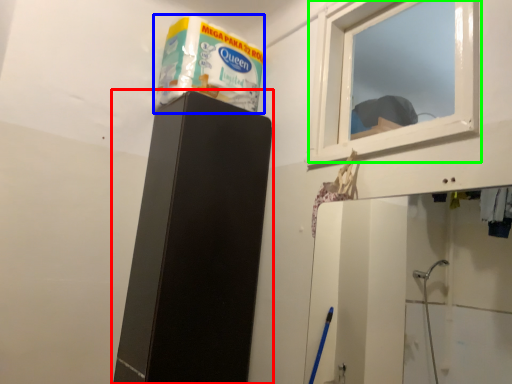
Question: Which object is positioned closest to furniture (highlighted by a red box)? Select from product (highlighted by a blue box) and window (highlighted by a green box).

Choices:
 (A) product
 (B) window

Answer: (A)